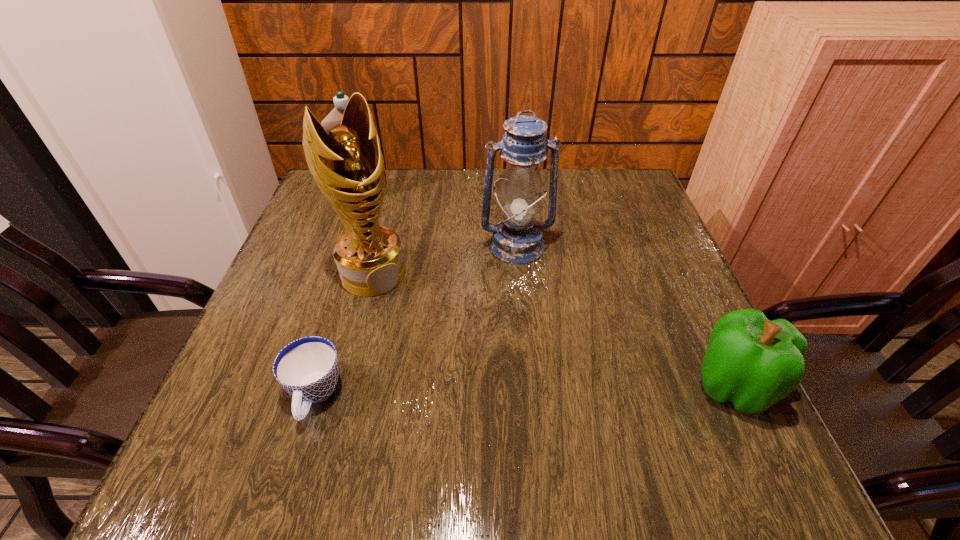
You are a GUI agent. You are given a task and a screenshot of the screen. Output one action in this format:
    pyautogui.click(x=<x>, y=<y>)
    Task: Click on the vacant space on the desktop that is between the cup and the rightmost object and is positioned on the front-facing side of the award
    
    Given the screenshot: What is the action you would take?
    pyautogui.click(x=463, y=392)

Where is `vacant space on the desktop that is between the cup and the rightmost object and is positioned on the front surface of the detergent`? vacant space on the desktop that is between the cup and the rightmost object and is positioned on the front surface of the detergent is located at coordinates (536, 390).

The width and height of the screenshot is (960, 540). Find the location of `vacant space on the desktop that is between the cup and the rightmost object and is positioned on the front-facing side of the second tallest object`. vacant space on the desktop that is between the cup and the rightmost object and is positioned on the front-facing side of the second tallest object is located at coordinates (550, 390).